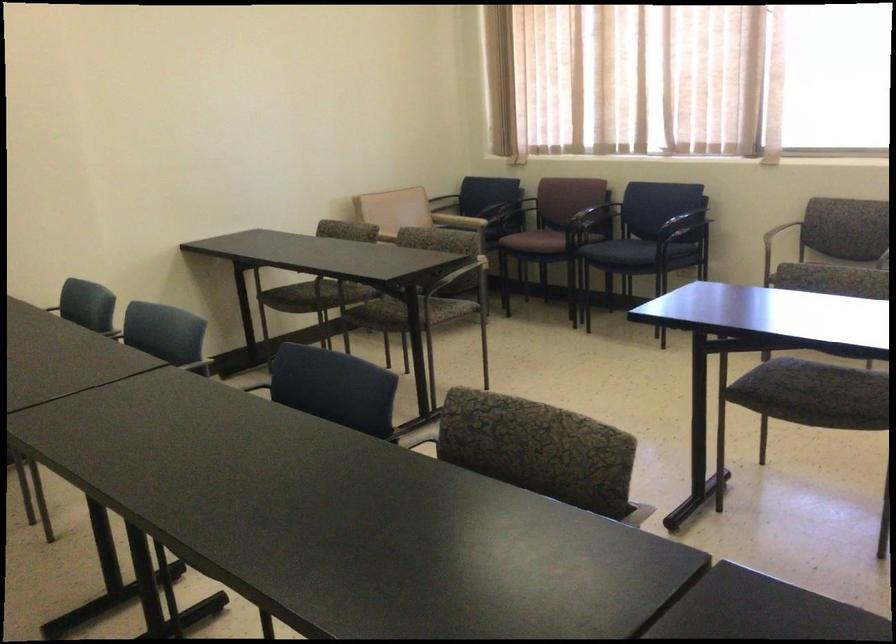
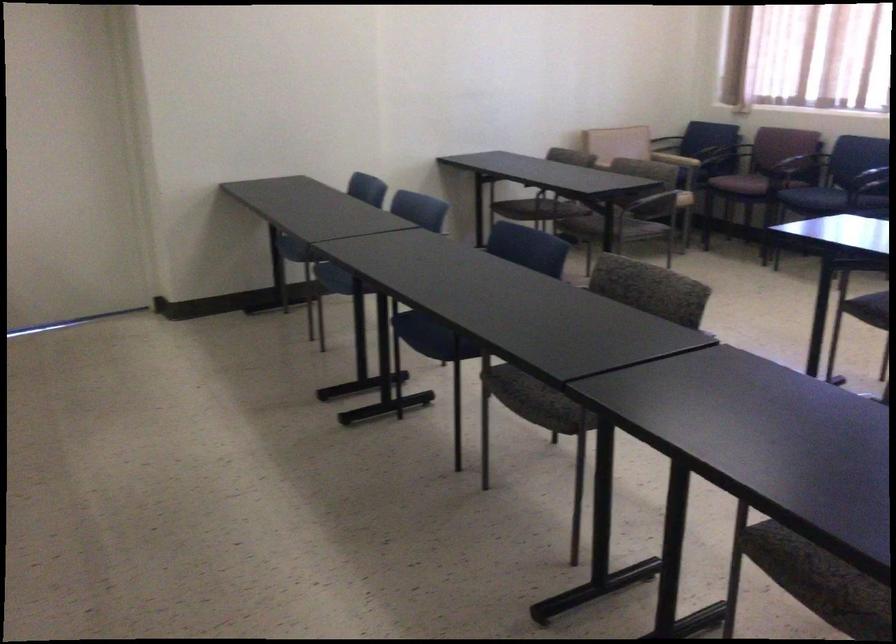
Find the pixel in the second image that matches (x=457, y=279) in the first image.

(655, 204)